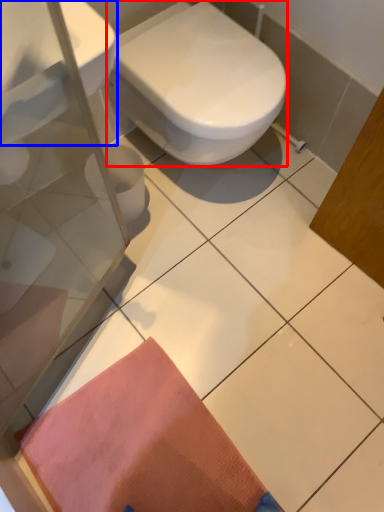
Question: Which point is further to the camera, bidet (highlighted by a red box) or sink (highlighted by a blue box)?

Choices:
 (A) bidet
 (B) sink

Answer: (A)